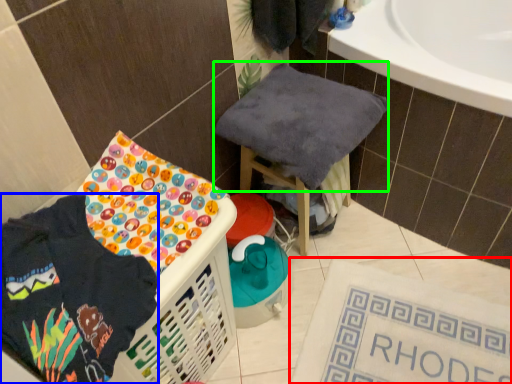
Question: Estimate the real-world distances between objects in this image. Which object is closer to bath mat (highlighted by a red box), clothing (highlighted by a blue box) or baby clothe (highlighted by a green box)?

Choices:
 (A) clothing
 (B) baby clothe

Answer: (B)